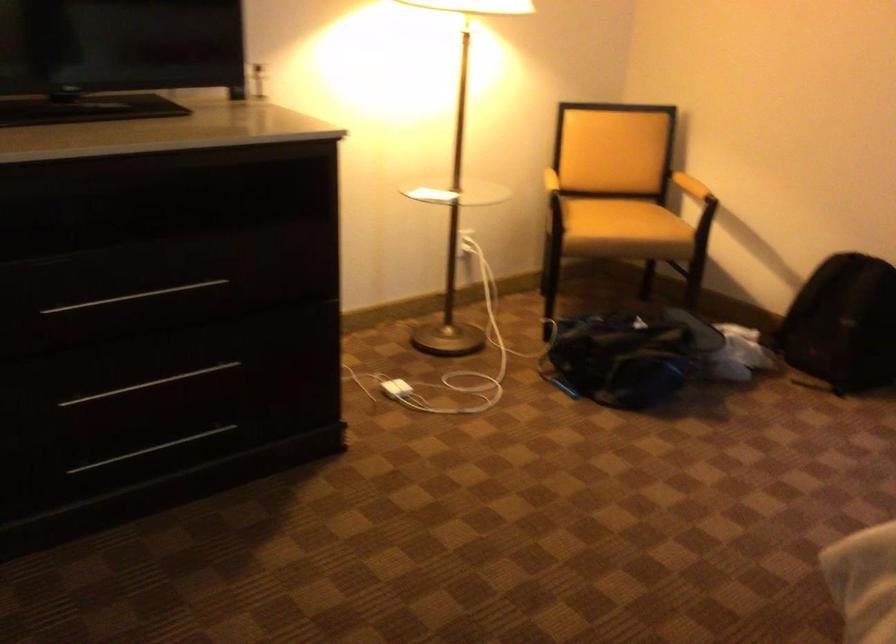
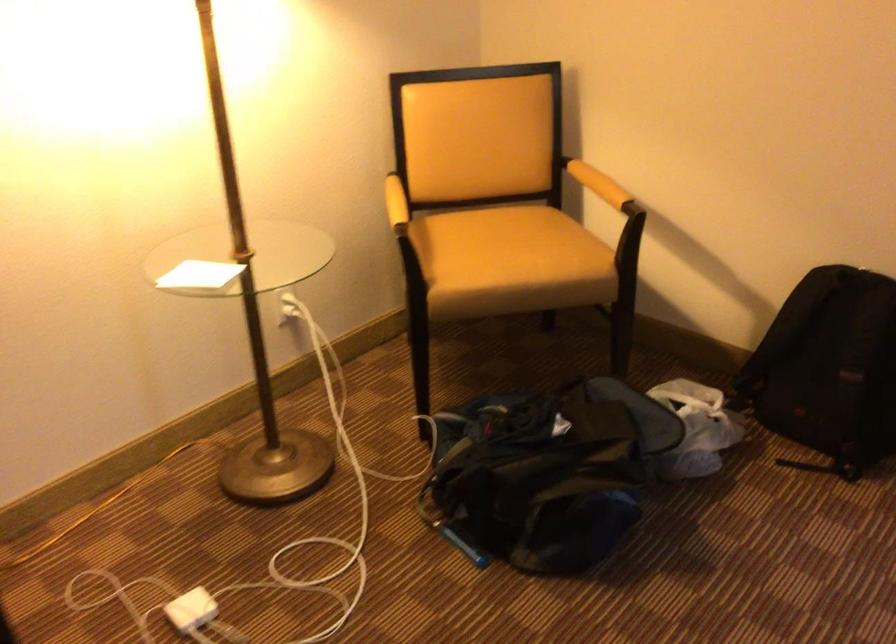
Locate, in the second image, the point that corresponds to point 731,343 in the first image.

(696, 428)